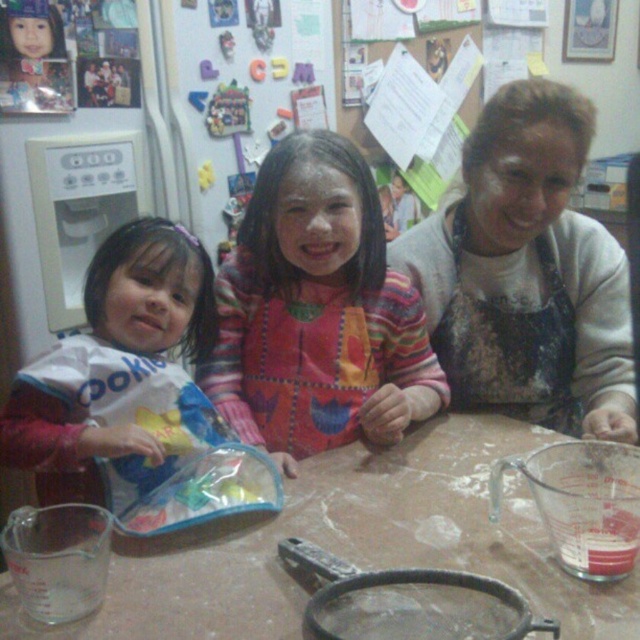
Question: Considering the relative positions of transparent plastic table at center and dark gray apron at center in the image provided, where is transparent plastic table at center located with respect to dark gray apron at center?

Choices:
 (A) left
 (B) right

Answer: (A)

Question: Observing the image, what is the correct spatial positioning of transparent plastic table at center in reference to dark gray apron at center?

Choices:
 (A) left
 (B) right

Answer: (A)

Question: Which object is closer to the camera taking this photo?

Choices:
 (A) transparent plastic table at center
 (B) dark gray apron at center
 (C) white paper bag at left

Answer: (A)

Question: Which point appears farthest from the camera in this image?

Choices:
 (A) (579, 237)
 (B) (38, 484)
 (C) (316, 371)
 (D) (248, 586)

Answer: (A)

Question: Among these points, which one is nearest to the camera?

Choices:
 (A) (166, 330)
 (B) (369, 317)

Answer: (A)

Question: Does dark gray apron at center come behind multicolored fabric dress at center?

Choices:
 (A) no
 (B) yes

Answer: (A)